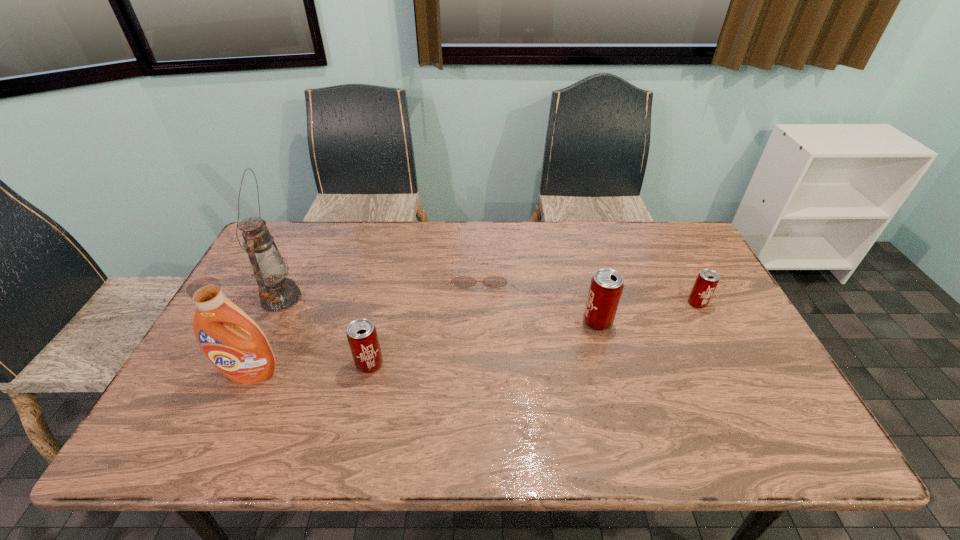
Identify which beer can is the third nearest to the fifth shortest object. Please provide its 2D coordinates. Your answer should be formatted as a tuple, i.e. [(x, y)], where the tuple contains the x and y coordinates of a point satisfying the conditions above.

[(707, 280)]

Locate an element on the screen. Image resolution: width=960 pixels, height=540 pixels. vacant space that satisfies the following two spatial constraints: 1. on the back side of the nearest beer can; 2. on the left side of the rightmost beer can is located at coordinates (384, 303).